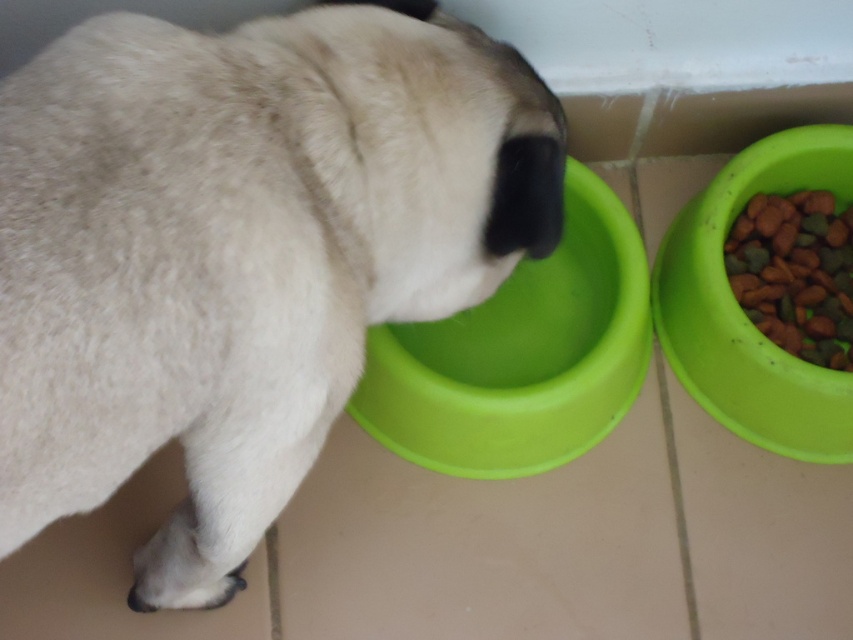
Question: Can you confirm if green plastic bowl at right is wider than green matte kibble at right?

Choices:
 (A) yes
 (B) no

Answer: (A)

Question: Is green plastic bowl at lower left further to the viewer compared to green matte kibble at right?

Choices:
 (A) no
 (B) yes

Answer: (A)

Question: Is white matte dog at center below green plastic bowl at lower left?

Choices:
 (A) no
 (B) yes

Answer: (A)

Question: Considering the real-world distances, which object is closest to the green plastic bowl at lower left?

Choices:
 (A) white matte dog at center
 (B) green plastic bowl at right

Answer: (B)

Question: Which of the following is the farthest from the observer?

Choices:
 (A) (808, 182)
 (B) (500, 372)
 (C) (776, 234)
 (D) (122, 432)

Answer: (A)

Question: Which is farther from the green matte kibble at right?

Choices:
 (A) green plastic bowl at right
 (B) white matte dog at center

Answer: (B)